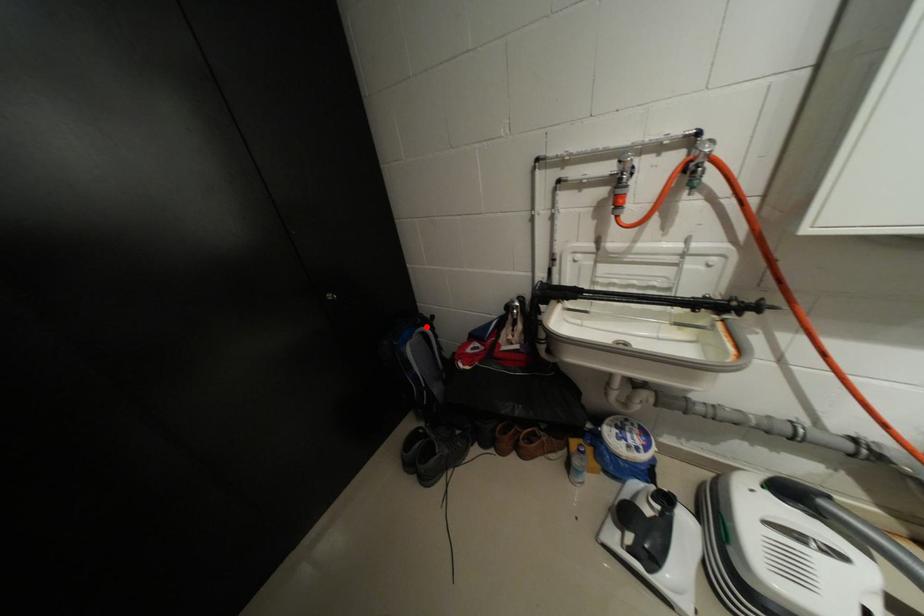
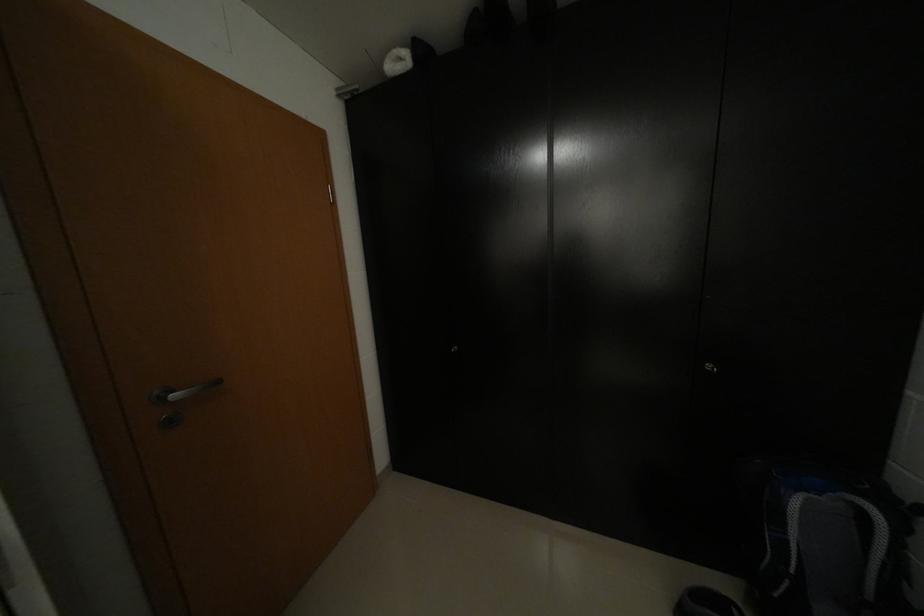
Question: I am providing you with two images of the same scene from different viewpoints. In image1, a red point is highlighted. Considering the same 3D point in image2, which of the following is correct?

Choices:
 (A) It is closer
 (B) It is farther

Answer: (B)